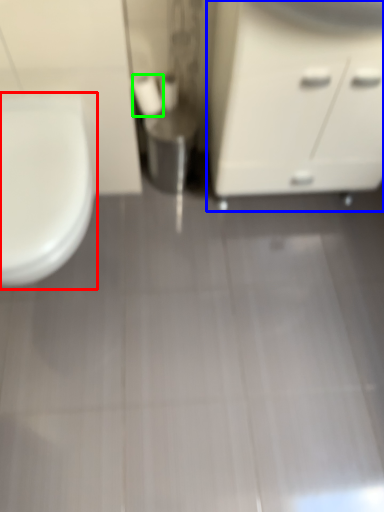
Question: Estimate the real-world distances between objects in this image. Which object is farther from toilet (highlighted by a red box), bathroom cabinet (highlighted by a blue box) or toilet paper (highlighted by a green box)?

Choices:
 (A) bathroom cabinet
 (B) toilet paper

Answer: (A)